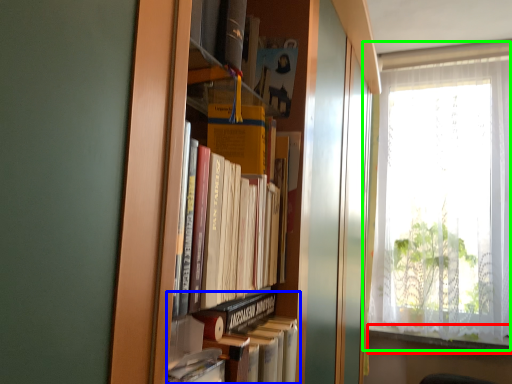
Question: Which object is the closest to the window sill (highlighted by a red box)? Choose among these: book (highlighted by a blue box) or window (highlighted by a green box).

Choices:
 (A) book
 (B) window

Answer: (B)